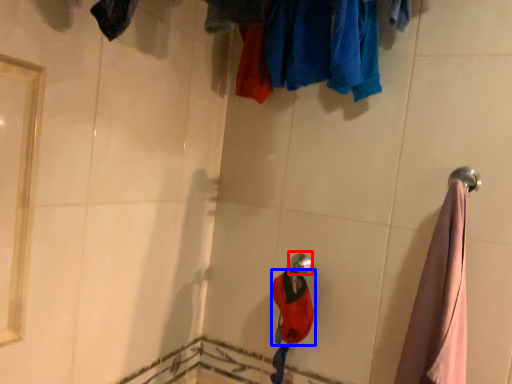
Question: Which point is further to the camera, shower (highlighted by a red box) or clothing (highlighted by a blue box)?

Choices:
 (A) shower
 (B) clothing

Answer: (A)